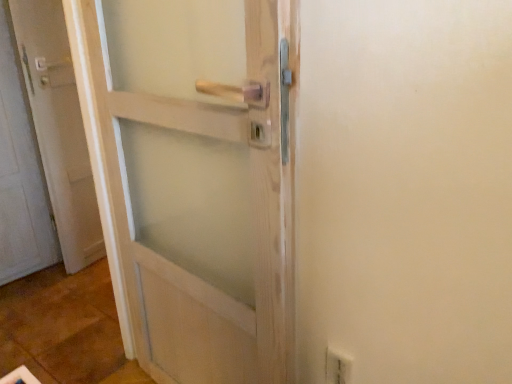
Question: Does white plastic electric outlet at lower right appear on the right side of white matte door at left?

Choices:
 (A) yes
 (B) no

Answer: (A)

Question: Is white plastic electric outlet at lower right not near white matte door at left?

Choices:
 (A) yes
 (B) no

Answer: (A)

Question: From the image's perspective, is white plastic electric outlet at lower right on white matte door at left?

Choices:
 (A) no
 (B) yes

Answer: (A)

Question: Is white plastic electric outlet at lower right oriented towards white matte door at left?

Choices:
 (A) no
 (B) yes

Answer: (A)

Question: Is white plastic electric outlet at lower right facing away from white matte door at left?

Choices:
 (A) no
 (B) yes

Answer: (A)

Question: Considering the relative positions of white plastic electric outlet at lower right and white matte door at left in the image provided, is white plastic electric outlet at lower right to the left of white matte door at left from the viewer's perspective?

Choices:
 (A) yes
 (B) no

Answer: (B)

Question: Could white plastic electric outlet at lower right be considered to be inside white matte door at left?

Choices:
 (A) no
 (B) yes

Answer: (A)

Question: From the image's perspective, is white matte door at left on white plastic electric outlet at lower right?

Choices:
 (A) no
 (B) yes

Answer: (B)

Question: Is white matte door at left not close to white plastic electric outlet at lower right?

Choices:
 (A) no
 (B) yes

Answer: (B)

Question: Is white matte door at left closer to camera compared to white plastic electric outlet at lower right?

Choices:
 (A) no
 (B) yes

Answer: (A)

Question: Does white matte door at left have a smaller size compared to white plastic electric outlet at lower right?

Choices:
 (A) yes
 (B) no

Answer: (B)

Question: Are white matte door at left and white plastic electric outlet at lower right beside each other?

Choices:
 (A) yes
 (B) no

Answer: (B)

Question: From their relative heights in the image, would you say white plastic electric outlet at lower right is taller or shorter than white matte door at left?

Choices:
 (A) short
 (B) tall

Answer: (A)